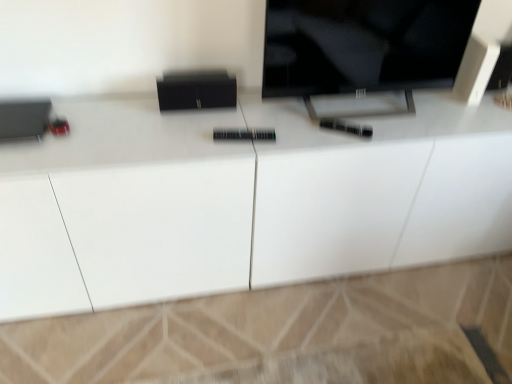
This screenshot has width=512, height=384. What do you see at coordinates (362, 46) in the screenshot?
I see `black glossy tv at upper center` at bounding box center [362, 46].

I want to click on black glossy tv at upper center, so click(x=362, y=46).

The image size is (512, 384). What do you see at coordinates (242, 201) in the screenshot?
I see `white glossy cabinet at center` at bounding box center [242, 201].

You are a GUI agent. You are given a task and a screenshot of the screen. Output one action in this format:
    pyautogui.click(x=<x>, y=<y>)
    Task: Click on the white glossy cabinet at center
    The width and height of the screenshot is (512, 384).
    Given the screenshot: What is the action you would take?
    pyautogui.click(x=242, y=201)

Where is `black glossy tv at upper center`? black glossy tv at upper center is located at coordinates [362, 46].

Is white glossy cabinet at center to the left of black glossy tv at upper center from the viewer's perspective?

Yes, white glossy cabinet at center is to the left of black glossy tv at upper center.

Is the position of white glossy cabinet at center less distant than that of black glossy tv at upper center?

That is True.

Is point (313, 194) behind point (433, 32)?

Yes.

From the image's perspective, does white glossy cabinet at center appear lower than black glossy tv at upper center?

Yes, from the image's perspective, white glossy cabinet at center is below black glossy tv at upper center.

From a real-world perspective, is white glossy cabinet at center physically located above or below black glossy tv at upper center?

In terms of real-world spatial position, white glossy cabinet at center is below black glossy tv at upper center.

Which of these two, white glossy cabinet at center or black glossy tv at upper center, is wider?

Wider between the two is white glossy cabinet at center.

Is white glossy cabinet at center taller or shorter than black glossy tv at upper center?

In the image, white glossy cabinet at center appears to be taller than black glossy tv at upper center.

Is white glossy cabinet at center smaller than black glossy tv at upper center?

No.

Would you say black glossy tv at upper center is part of white glossy cabinet at center's contents?

No, white glossy cabinet at center does not contain black glossy tv at upper center.

Can you see white glossy cabinet at center touching black glossy tv at upper center?

white glossy cabinet at center is not next to black glossy tv at upper center, and they're not touching.

Is white glossy cabinet at center oriented towards black glossy tv at upper center?

No.

Looking at this image, can you tell me how much white glossy cabinet at center and black glossy tv at upper center differ in facing direction?

There is a 0.000109-degree angle between the facing directions of white glossy cabinet at center and black glossy tv at upper center.

At what (x,y) coordinates should I click in order to perform the action: click on television that appears behind the white glossy cabinet at center. Please return your answer as a coordinate pair (x, y). Looking at the image, I should click on (362, 46).

Which object is positioned more to the left, black glossy tv at upper center or white glossy cabinet at center?

white glossy cabinet at center is more to the left.

Which object is closer to the camera, black glossy tv at upper center or white glossy cabinet at center?

Positioned in front is white glossy cabinet at center.

Which is closer to the camera, (307, 17) or (463, 109)?

Point (307, 17).

From the image's perspective, is black glossy tv at upper center on top of white glossy cabinet at center?

Yes.

From a real-world perspective, is black glossy tv at upper center on white glossy cabinet at center?

Yes, from a real-world perspective, black glossy tv at upper center is over white glossy cabinet at center

Which of these two, black glossy tv at upper center or white glossy cabinet at center, is wider?

Wider between the two is white glossy cabinet at center.

Does black glossy tv at upper center have a greater height compared to white glossy cabinet at center?

Incorrect, the height of black glossy tv at upper center is not larger of that of white glossy cabinet at center.

Considering the sizes of objects black glossy tv at upper center and white glossy cabinet at center in the image provided, who is bigger, black glossy tv at upper center or white glossy cabinet at center?

Bigger between the two is white glossy cabinet at center.

In the scene shown: Would you say white glossy cabinet at center is part of black glossy tv at upper center's contents?

No, white glossy cabinet at center is not surrounded by black glossy tv at upper center.

From the picture: Is black glossy tv at upper center next to white glossy cabinet at center?

No, black glossy tv at upper center is not making contact with white glossy cabinet at center.

Is white glossy cabinet at center at the back of black glossy tv at upper center?

No, black glossy tv at upper center's orientation is not away from white glossy cabinet at center.

What's the angular difference between black glossy tv at upper center and white glossy cabinet at center's facing directions?

The angular difference between black glossy tv at upper center and white glossy cabinet at center is 0.000109 degrees.

Identify the location of cabinetry that appears on the left of black glossy tv at upper center. (242, 201).

Where is `television behind the white glossy cabinet at center`? television behind the white glossy cabinet at center is located at coordinates (362, 46).

Find the location of a particular element. television that appears above the white glossy cabinet at center (from a real-world perspective) is located at coordinates (362, 46).